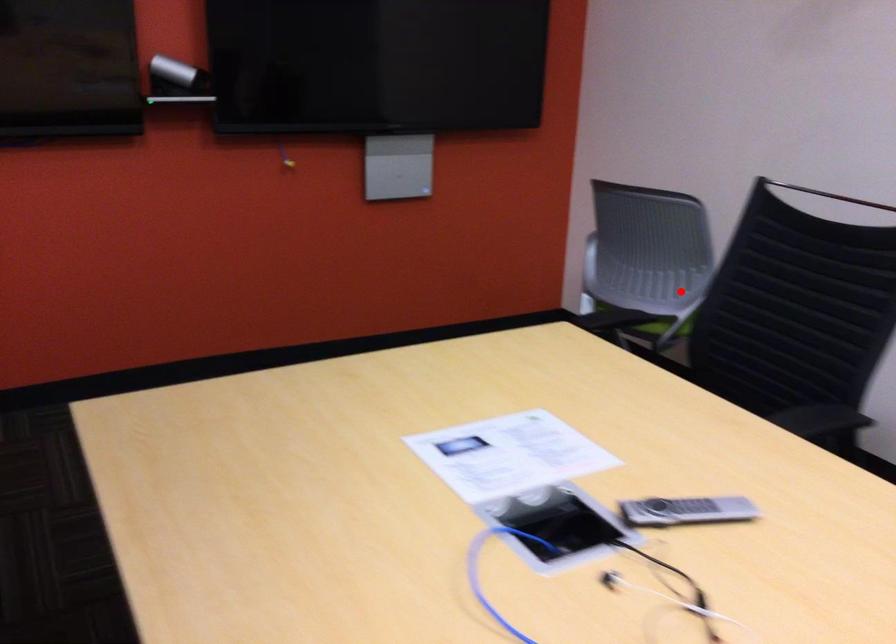
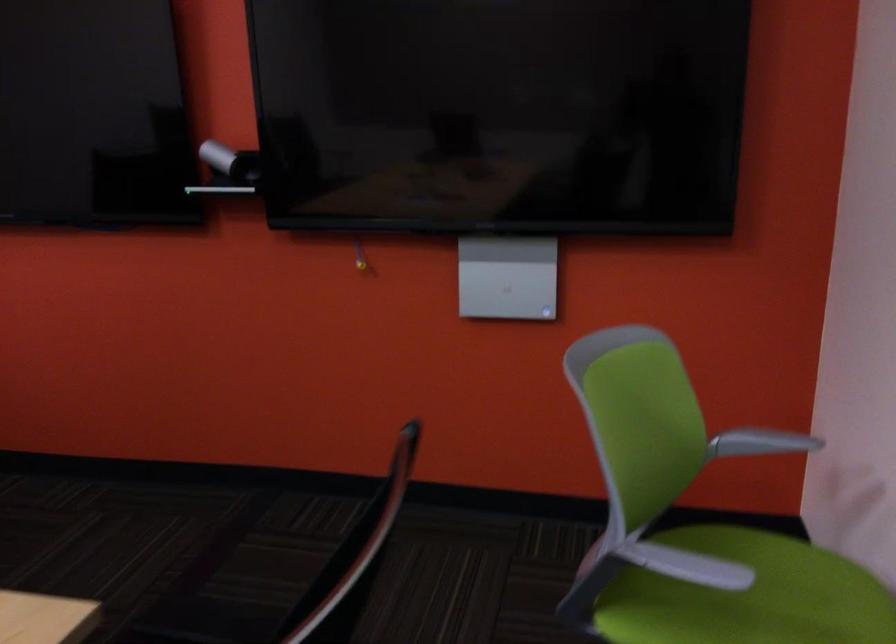
In the second image, find the point that corresponds to the highlighted location in the first image.

(747, 596)